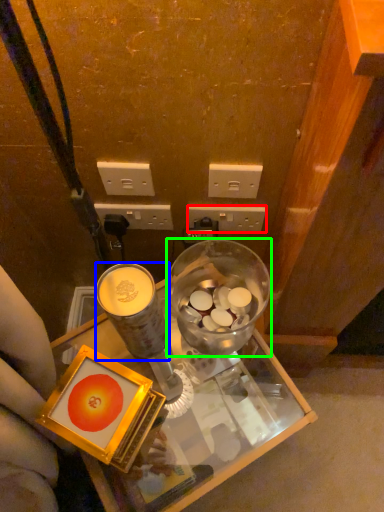
Question: Which object is positioned closest to power outlet (highlighted by a red box)? Select from coffee cup (highlighted by a blue box) and tableware (highlighted by a green box).

Choices:
 (A) coffee cup
 (B) tableware

Answer: (B)